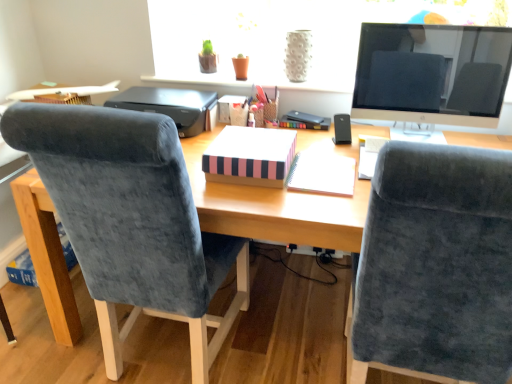
Where is `free space in front of pink striped notebook at center, the first notebook from the left`? Image resolution: width=512 pixels, height=384 pixels. free space in front of pink striped notebook at center, the first notebook from the left is located at coordinates (271, 199).